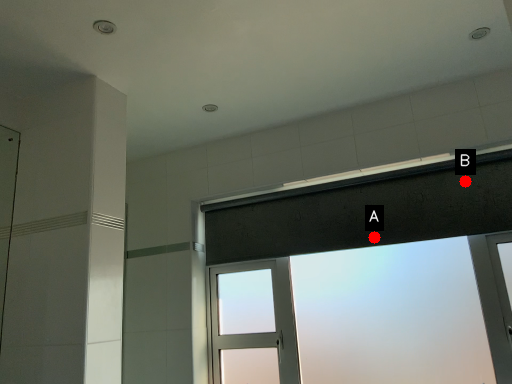
Question: Two points are circled on the image, labeled by A and B beside each circle. Which point appears closest to the camera in this image?

Choices:
 (A) A is closer
 (B) B is closer

Answer: (B)